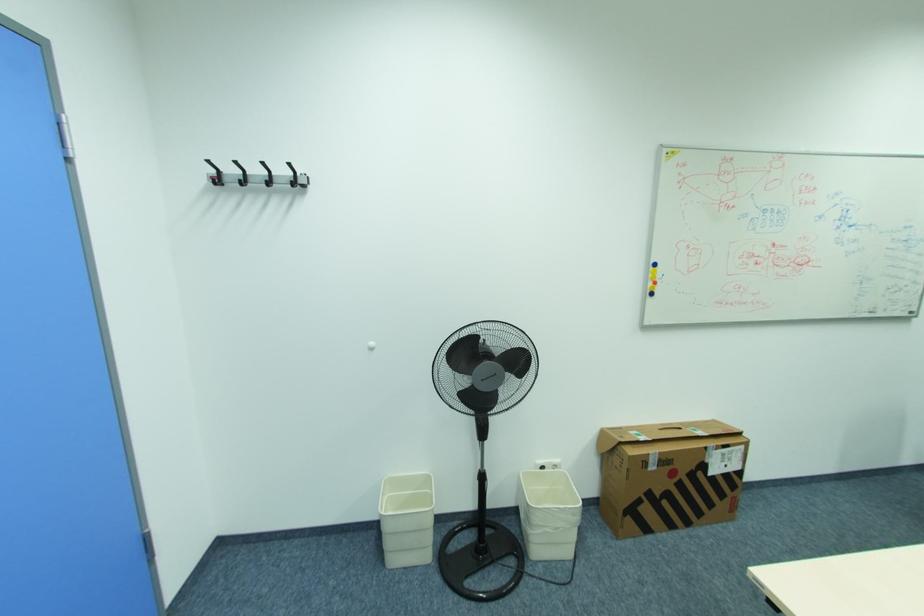
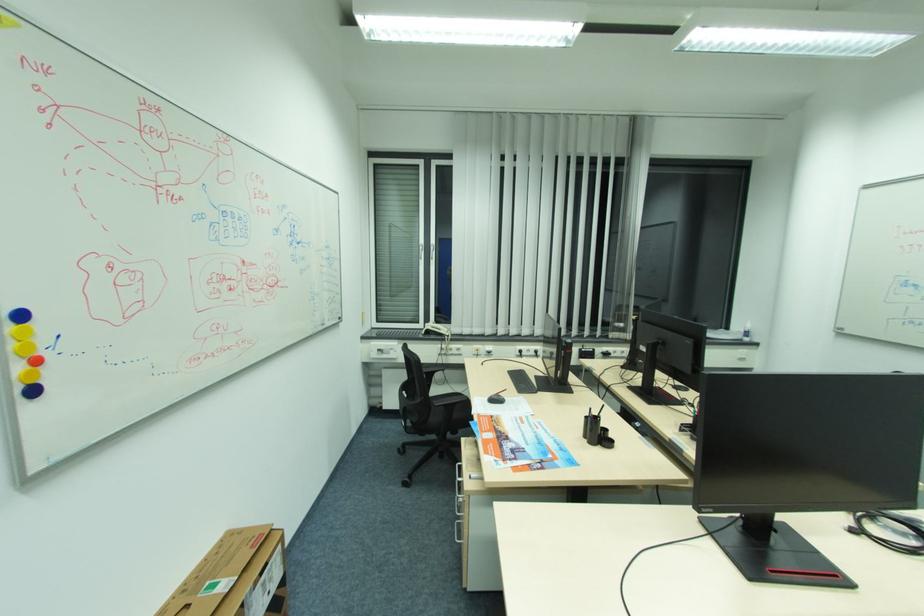
Question: The images are taken continuously from a first-person perspective. In which direction is your viewpoint rotating?

Choices:
 (A) Left
 (B) Right
 (C) Up
 (D) Down

Answer: (B)